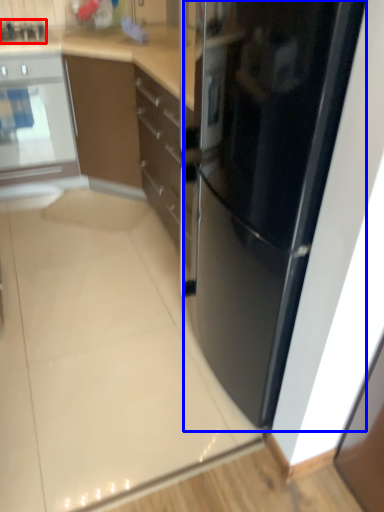
Question: Which object is closer to the camera taking this photo, appliance (highlighted by a red box) or refrigerator (highlighted by a blue box)?

Choices:
 (A) appliance
 (B) refrigerator

Answer: (B)